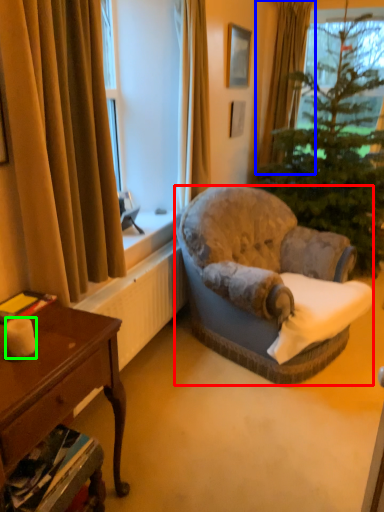
Question: Which object is the farthest from chair (highlighted by a red box)? Choose among these: curtain (highlighted by a blue box) or candle (highlighted by a green box).

Choices:
 (A) curtain
 (B) candle

Answer: (A)